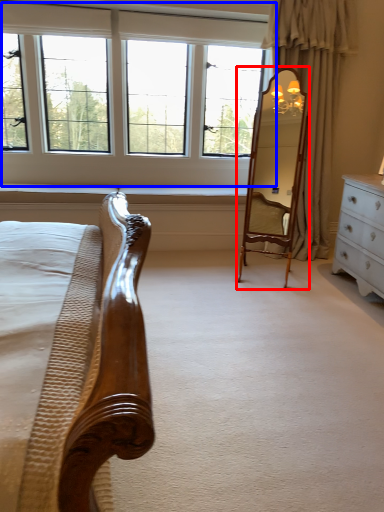
Question: Which object is further to the camera taking this photo, mirror (highlighted by a red box) or window (highlighted by a blue box)?

Choices:
 (A) mirror
 (B) window

Answer: (B)